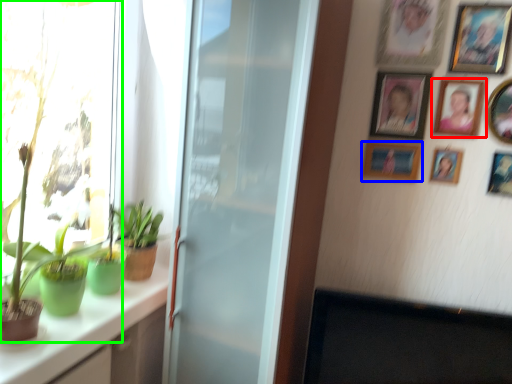
Question: Considering the real-world distances, which object is closest to picture frame (highlighted by a red box)? picture frame (highlighted by a blue box) or houseplant (highlighted by a green box).

Choices:
 (A) picture frame
 (B) houseplant

Answer: (A)